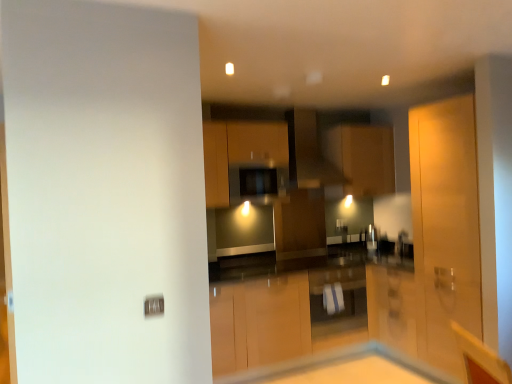
Question: Does white glossy cabinet at center, which appears as the 2th cabinetry when viewed from the left, have a greater height compared to matte wood cabinet at center, the first cabinetry viewed from the top?

Choices:
 (A) no
 (B) yes

Answer: (A)

Question: Considering the relative sizes of white glossy cabinet at center, acting as the second cabinetry starting from the right, and matte wood cabinet at center, the 3th cabinetry in the left-to-right sequence, in the image provided, is white glossy cabinet at center, acting as the second cabinetry starting from the right, bigger than matte wood cabinet at center, the 3th cabinetry in the left-to-right sequence,?

Choices:
 (A) yes
 (B) no

Answer: (B)

Question: From a real-world perspective, does white glossy cabinet at center, acting as the second cabinetry starting from the right, stand above matte wood cabinet at center, the first cabinetry viewed from the top?

Choices:
 (A) no
 (B) yes

Answer: (A)

Question: Is the position of white glossy cabinet at center, acting as the second cabinetry starting from the right, less distant than that of matte wood cabinet at center, which is counted as the third cabinetry, starting from the bottom?

Choices:
 (A) no
 (B) yes

Answer: (B)

Question: Is white glossy cabinet at center, acting as the second cabinetry starting from the right, oriented towards matte wood cabinet at center, the first cabinetry viewed from the top?

Choices:
 (A) yes
 (B) no

Answer: (B)

Question: Is white glossy cabinet at center, acting as the second cabinetry starting from the right, not close to matte wood cabinet at center, the first cabinetry viewed from the top?

Choices:
 (A) no
 (B) yes

Answer: (B)

Question: Would you say matte black exhaust hood at center contains matte wood cabinet at center, the 1th cabinetry positioned from the left?

Choices:
 (A) no
 (B) yes

Answer: (A)

Question: Can you confirm if matte black exhaust hood at center is smaller than matte wood cabinet at center, the 3th cabinetry from the right?

Choices:
 (A) yes
 (B) no

Answer: (A)

Question: Are matte black exhaust hood at center and matte wood cabinet at center, the 1th cabinetry positioned from the left, far apart?

Choices:
 (A) yes
 (B) no

Answer: (B)

Question: From a real-world perspective, is matte black exhaust hood at center over matte wood cabinet at center, the 1th cabinetry positioned from the left?

Choices:
 (A) no
 (B) yes

Answer: (B)

Question: Is matte black exhaust hood at center to the left of matte wood cabinet at center, the 1th cabinetry positioned from the left, from the viewer's perspective?

Choices:
 (A) no
 (B) yes

Answer: (A)

Question: Is matte black exhaust hood at center facing away from matte wood cabinet at center, which appears as the 2th cabinetry when viewed from the top?

Choices:
 (A) no
 (B) yes

Answer: (A)

Question: Considering the relative positions of matte wood cabinet at center, arranged as the first cabinetry when viewed from the right, and matte wood cabinet at center, which appears as the 2th cabinetry when viewed from the top, in the image provided, is matte wood cabinet at center, arranged as the first cabinetry when viewed from the right, to the right of matte wood cabinet at center, which appears as the 2th cabinetry when viewed from the top, from the viewer's perspective?

Choices:
 (A) no
 (B) yes

Answer: (B)